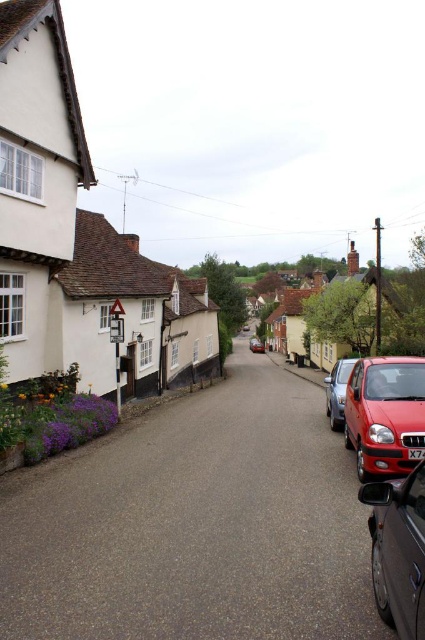
You are driving a car that is 4 meters long and need to park in this street. There are two available spots next to the shiny red car at right and the shiny silver car at lower right. Which parking spot would be more suitable for your car based on the size of the existing cars?

The shiny red car at right is larger than the shiny silver car at lower right, so the parking spot next to the shiny red car at right likely has more space and would be more suitable for your 4 meter long car.